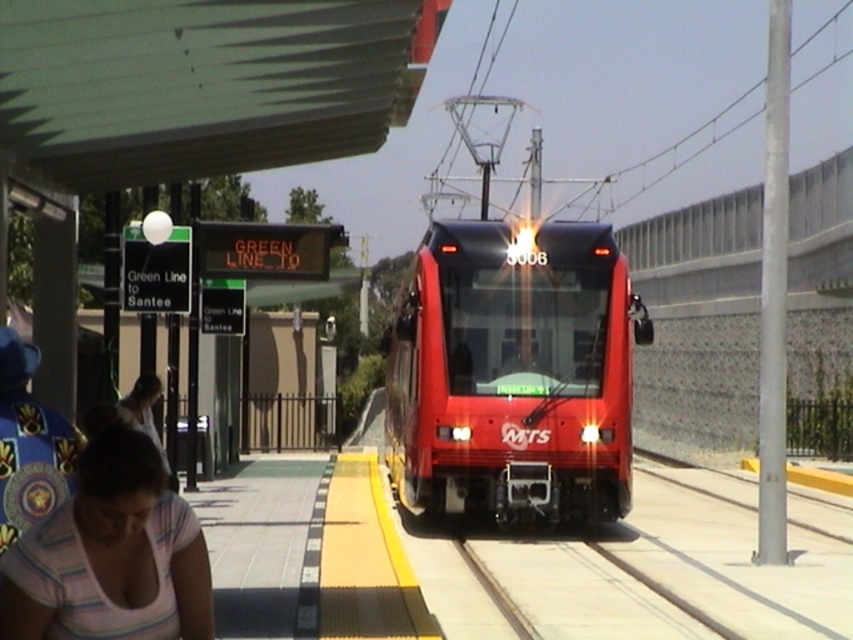
You are a passenger waiting at the train station. You see a pink striped shirt at lower left and a metal train track at center. Which object is larger in size?

The pink striped shirt at lower left is smaller than the metal train track at center according to the description.

You are a maintenance worker inspecting the train station platform. You notice the shiny red train at center and the metal train track at center. Which object is taller?

The shiny red train at center is taller than the metal train track at center.

You are a passenger waiting at the train station platform. You see the shiny red train at center and the pink striped shirt at lower left. Which object is closer to you?

The shiny red train at center is closer to you than the pink striped shirt at lower left.